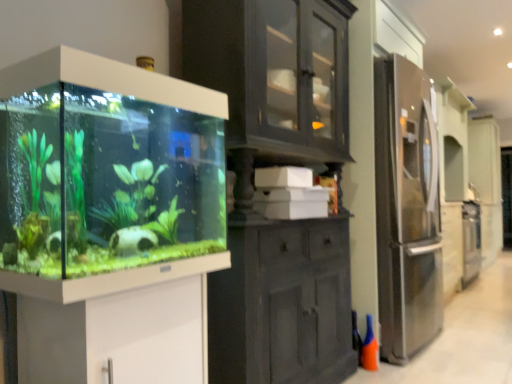
Question: Is orange matte cone at lower right facing towards white glossy vanity at lower left?

Choices:
 (A) no
 (B) yes

Answer: (A)

Question: From a real-world perspective, is orange matte cone at lower right positioned over white glossy vanity at lower left based on gravity?

Choices:
 (A) no
 (B) yes

Answer: (A)

Question: Does orange matte cone at lower right have a lesser height compared to white glossy vanity at lower left?

Choices:
 (A) no
 (B) yes

Answer: (B)

Question: Is orange matte cone at lower right turned away from white glossy vanity at lower left?

Choices:
 (A) no
 (B) yes

Answer: (A)

Question: Is orange matte cone at lower right further to camera compared to white glossy vanity at lower left?

Choices:
 (A) no
 (B) yes

Answer: (B)

Question: Are orange matte cone at lower right and white glossy vanity at lower left located far from each other?

Choices:
 (A) no
 (B) yes

Answer: (B)

Question: From the image's perspective, is transparent glass aquarium at left above white glossy vanity at lower left?

Choices:
 (A) no
 (B) yes

Answer: (B)

Question: Is transparent glass aquarium at left to the right of white glossy vanity at lower left from the viewer's perspective?

Choices:
 (A) no
 (B) yes

Answer: (B)

Question: From a real-world perspective, is transparent glass aquarium at left physically above white glossy vanity at lower left?

Choices:
 (A) no
 (B) yes

Answer: (B)

Question: Is transparent glass aquarium at left shorter than white glossy vanity at lower left?

Choices:
 (A) no
 (B) yes

Answer: (A)

Question: Does transparent glass aquarium at left turn towards white glossy vanity at lower left?

Choices:
 (A) yes
 (B) no

Answer: (B)

Question: Considering the relative sizes of transparent glass aquarium at left and white glossy vanity at lower left in the image provided, is transparent glass aquarium at left wider than white glossy vanity at lower left?

Choices:
 (A) no
 (B) yes

Answer: (A)

Question: Is orange matte cone at lower right positioned before transparent glass aquarium at left?

Choices:
 (A) no
 (B) yes

Answer: (A)